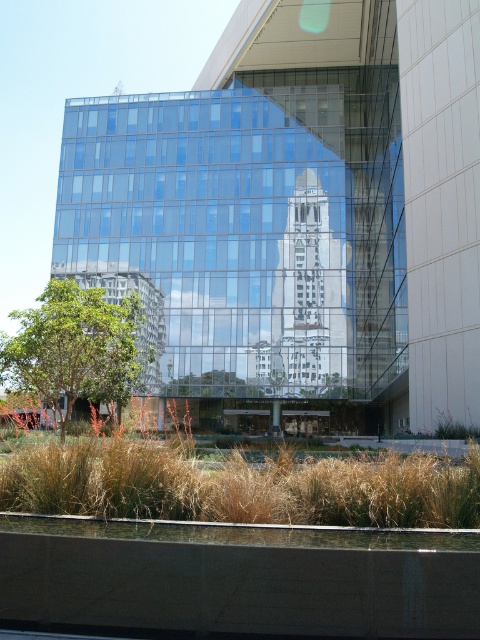
You are a city planner reviewing this architectural design. You need to ensure that the brown dry grass at lower center is wider than the transparent glass building at center for aesthetic balance. Based on the provided image, does the current design meet this requirement?

The transparent glass building at center is wider than brown dry grass at lower center, so the design does not meet the requirement as the brown dry grass at lower center is narrower than the building.